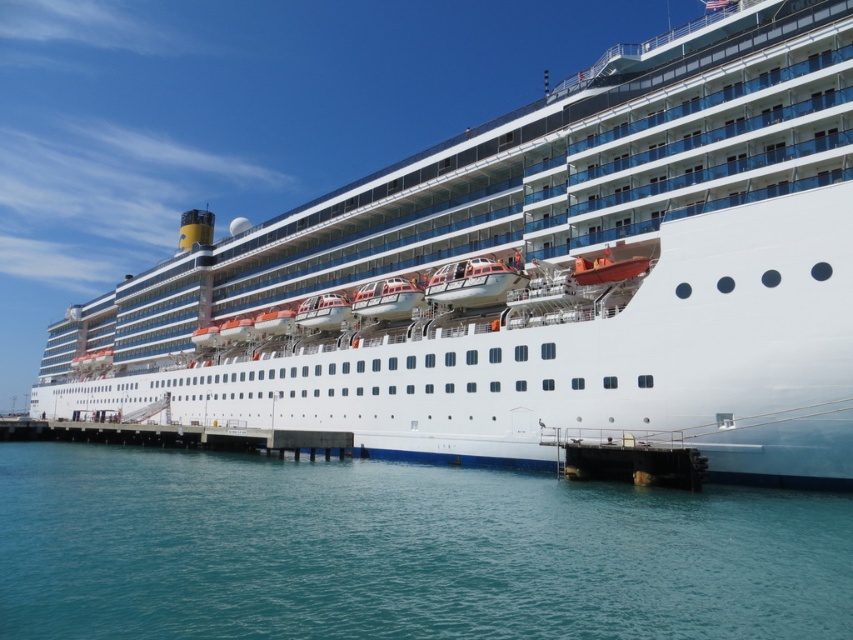
Question: Which object appears closest to the camera in this image?

Choices:
 (A) clear blue water at lower center
 (B) white concrete dock at lower center
 (C) white glossy cruise ship at center

Answer: (A)

Question: From the image, what is the correct spatial relationship of white glossy cruise ship at center in relation to white concrete dock at lower center?

Choices:
 (A) left
 (B) right

Answer: (B)

Question: Does white glossy cruise ship at center appear on the left side of white concrete dock at lower center?

Choices:
 (A) yes
 (B) no

Answer: (B)

Question: Which point is closer to the camera taking this photo?

Choices:
 (A) (107, 426)
 (B) (241, 305)

Answer: (A)

Question: Which object is the farthest from the clear blue water at lower center?

Choices:
 (A) white concrete dock at lower center
 (B) white glossy cruise ship at center

Answer: (B)

Question: Can you confirm if white glossy cruise ship at center is positioned to the left of white concrete dock at lower center?

Choices:
 (A) no
 (B) yes

Answer: (A)